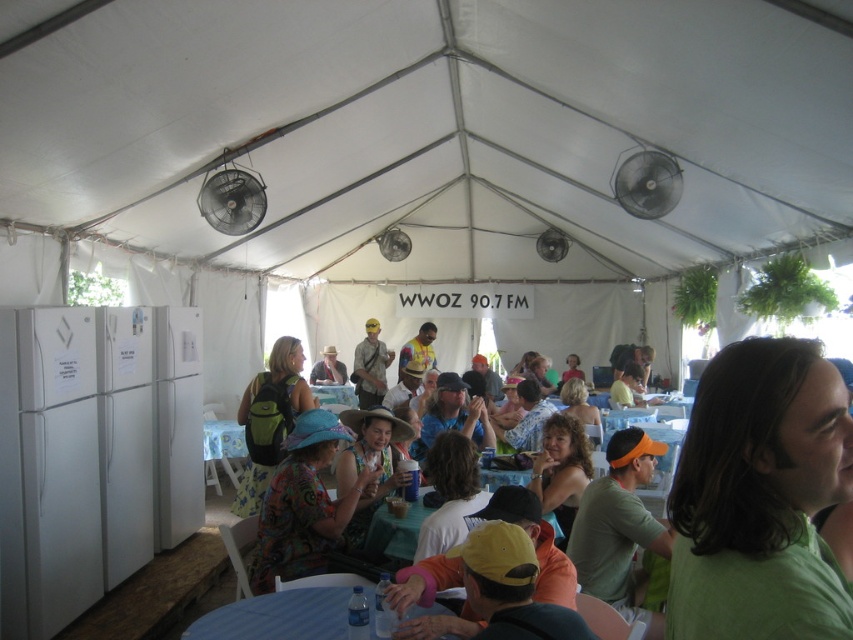
Question: Is the position of white fabric canopy at upper center more distant than that of printed fabric dress at center?

Choices:
 (A) yes
 (B) no

Answer: (B)

Question: Does green matte shirt at center have a greater width compared to blue fabric table at lower left?

Choices:
 (A) yes
 (B) no

Answer: (B)

Question: Which object is positioned farthest from the green cotton shirt at center?

Choices:
 (A) white fabric canopy at upper center
 (B) printed fabric dress at center

Answer: (A)

Question: Among these points, which one is farthest from the camera?

Choices:
 (A) (207, 636)
 (B) (360, 378)
 (C) (215, 435)
 (D) (785, 42)

Answer: (B)

Question: Which point is farther from the camera taking this photo?

Choices:
 (A) (758, 428)
 (B) (202, 435)
 (C) (660, 113)

Answer: (B)

Question: Can you confirm if matte khaki shirt at center is smaller than matte black hat at center?

Choices:
 (A) yes
 (B) no

Answer: (B)